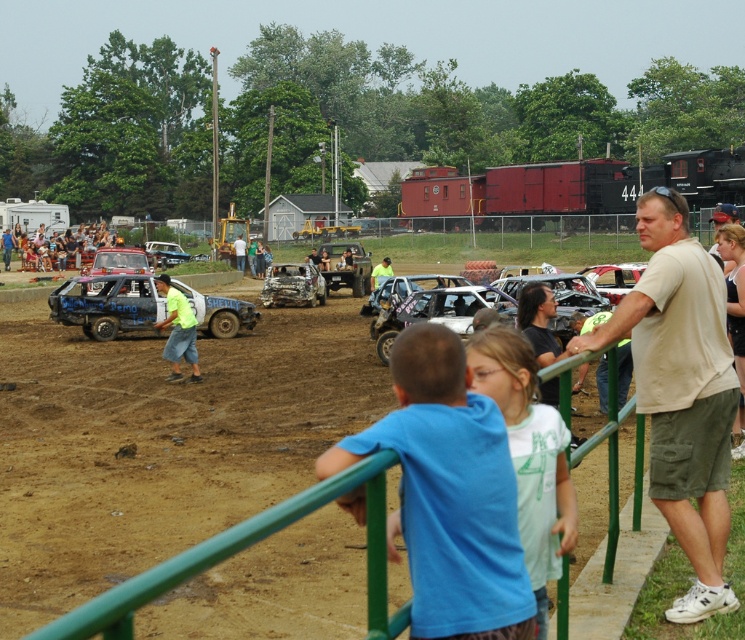
Based on the photo, you are a spectator at the demolition derby event. You see the blue matte car at center and the rusty metal wreck at center. Which one is positioned more to the left side of the track?

The blue matte car at center is positioned more to the left side of the track than the rusty metal wreck at center.

You are a safety inspector at the demolition derby. You need to ensure that the distance between the rusty metal car at center and the matte black car at center is at least 2 meters to prevent collisions. Is the current distance sufficient?

The rusty metal car at center is 1.55 meters away from the matte black car at center, which is less than the required 2 meters. Therefore, the current distance is not sufficient to prevent collisions.